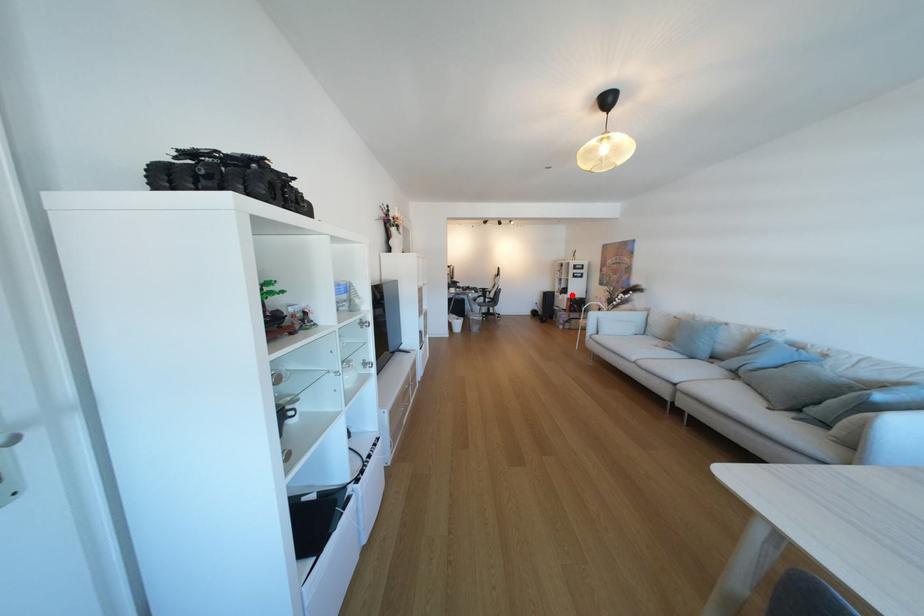
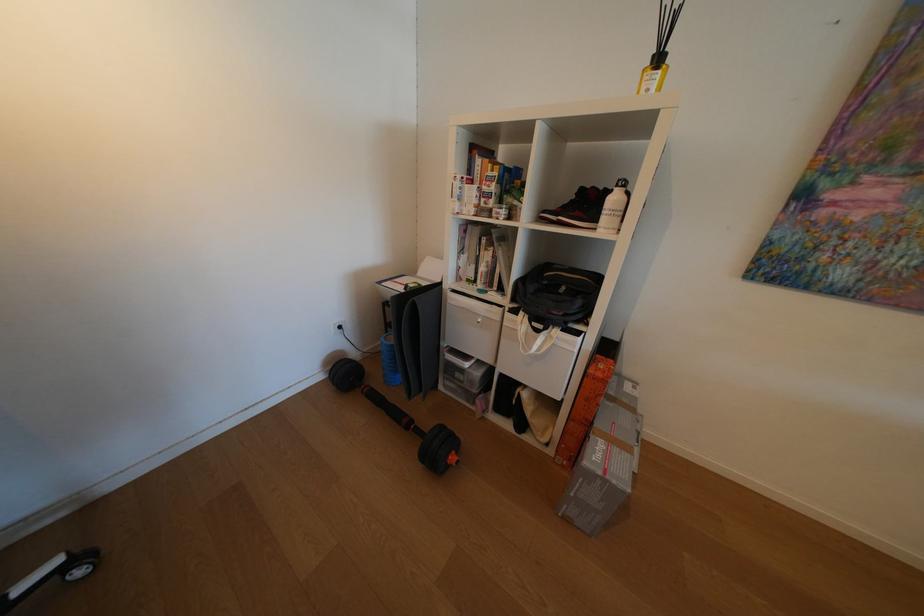
Locate, in the second image, the point that corresponds to the highlighted location in the first image.

(548, 331)